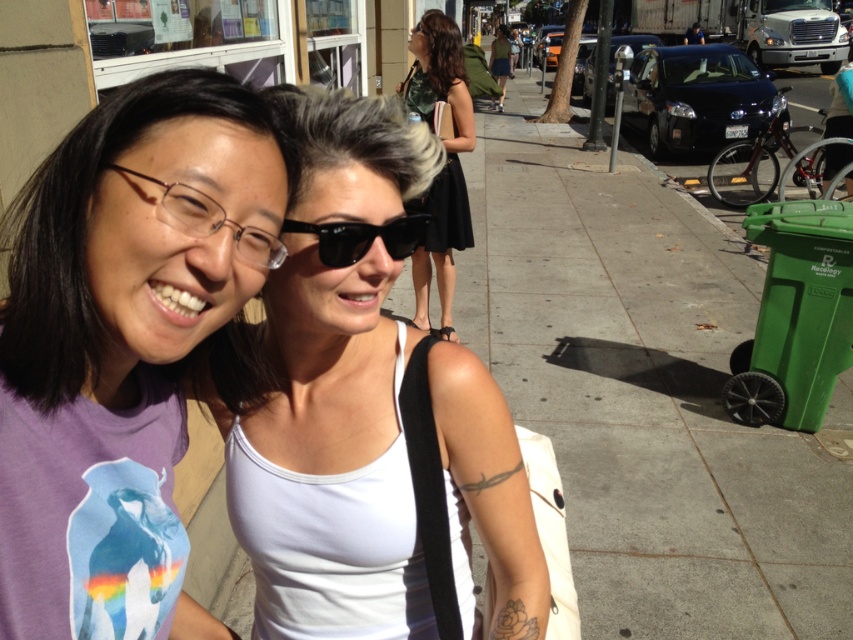
You are a fashion designer observing the urban scene. You notice the white matte tank top at center and the green textured dress at upper center. Which clothing item appears to be the smaller one in size?

The white matte tank top at center is smaller than the green textured dress at upper center, so the white matte tank top at center is the smaller one in size.

You are a delivery person who needs to place a large package in the green plastic trash can at right. However, you notice the green textured dress at upper center nearby. Considering their sizes, can you fit the package into the trash can without it overlapping the dress?

The green plastic trash can at right is larger than the green textured dress at upper center. Since the package is large, it can fit into the trash can as long as it doesn not exceed the trash can s capacity, and won t overlap the dress if placed properly.

In the scene shown: You are a delivery robot with a box that is 10 feet long. You need to move from the white matte tank top at center to the green textured dress at upper center. Can your box fit through the space between them without bending?

The distance between the white matte tank top at center and the green textured dress at upper center is 8.01 feet. Since the box is 10 feet long, it cannot fit through the space between them without bending.